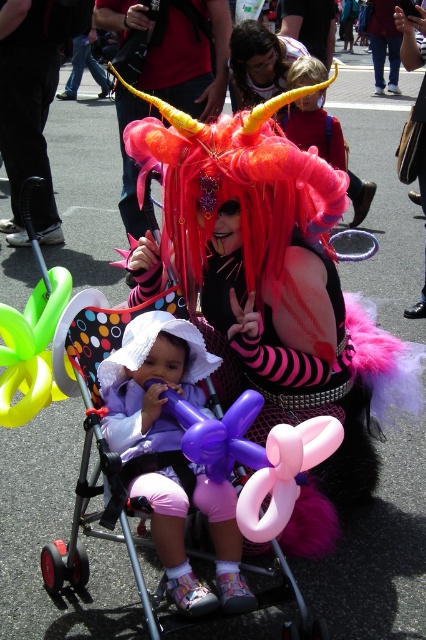
Looking at this image, does purple fabric balloon at center appear on the right side of pink rubber balloon at center?

No, purple fabric balloon at center is not to the right of pink rubber balloon at center.

Is purple fabric balloon at center behind pink rubber balloon at center?

Yes, it is.

I want to click on purple fabric balloon at center, so click(170, 454).

Between point (340, 387) and point (255, 534), which one is positioned in front?

Positioned in front is point (255, 534).

The image size is (426, 640). Describe the element at coordinates (264, 260) in the screenshot. I see `shiny pink wig at center` at that location.

Locate an element on the screen. shiny pink wig at center is located at coordinates (264, 260).

Who is shorter, purple fabric balloon at center or fluffy pink wig at center?

With less height is purple fabric balloon at center.

Does purple fabric balloon at center appear on the right side of fluffy pink wig at center?

In fact, purple fabric balloon at center is to the left of fluffy pink wig at center.

This screenshot has height=640, width=426. What are the coordinates of `purple fabric balloon at center` in the screenshot? It's located at (170, 454).